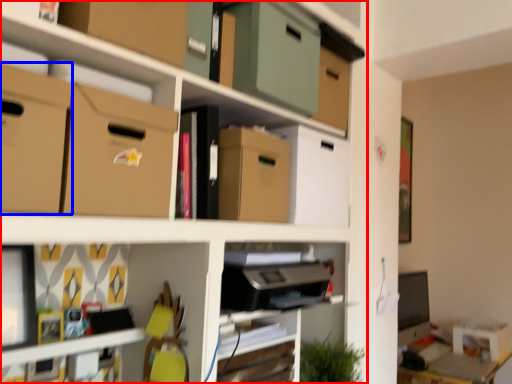
Question: Which of the following is the closest to the observer, shelf (highlighted by a red box) or cardboard box (highlighted by a blue box)?

Choices:
 (A) shelf
 (B) cardboard box

Answer: (A)